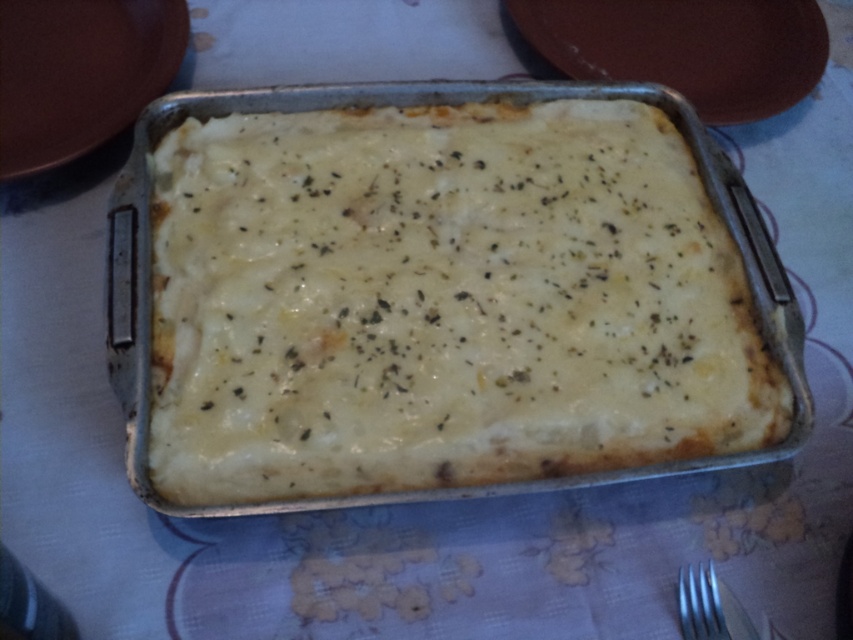
Question: Does matte brown platter at upper right have a smaller size compared to silver metallic fork at lower right?

Choices:
 (A) yes
 (B) no

Answer: (B)

Question: Among these objects, which one is nearest to the camera?

Choices:
 (A) silver metallic tray at center
 (B) matte brown platter at upper right
 (C) silver metallic fork at lower right
 (D) white creamy casserole at center

Answer: (D)

Question: Does white creamy casserole at center have a larger size compared to silver metallic fork at lower right?

Choices:
 (A) yes
 (B) no

Answer: (A)

Question: Which object appears farthest from the camera in this image?

Choices:
 (A) silver metallic fork at lower right
 (B) matte brown platter at upper right
 (C) white creamy casserole at center
 (D) silver metallic tray at center

Answer: (B)

Question: Does matte brown platter at upper right have a larger size compared to silver metallic fork at lower right?

Choices:
 (A) yes
 (B) no

Answer: (A)

Question: Which point appears farthest from the camera in this image?

Choices:
 (A) (596, 413)
 (B) (695, 628)

Answer: (A)